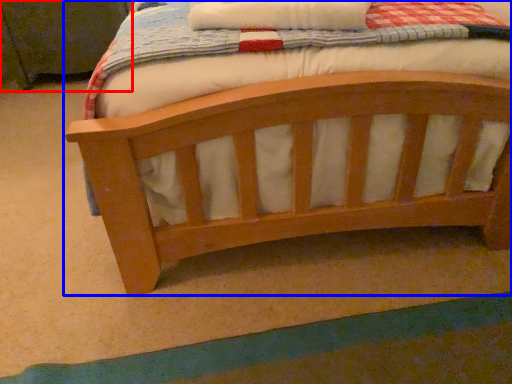
Question: Which object appears farthest to the camera in this image, changing table (highlighted by a red box) or bed (highlighted by a blue box)?

Choices:
 (A) changing table
 (B) bed

Answer: (A)